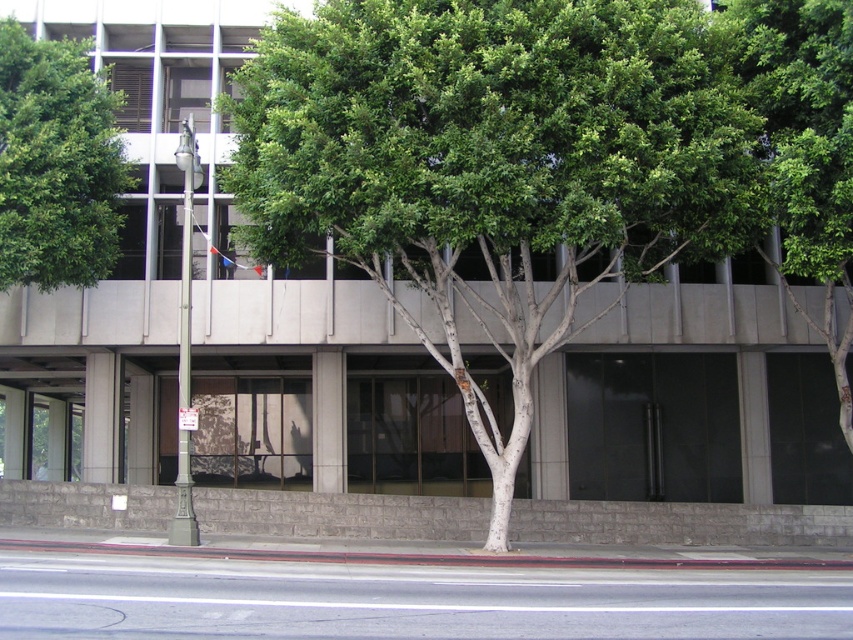
Does green leafy tree at center lie in front of green leafy tree at upper left?

Yes, green leafy tree at center is in front of green leafy tree at upper left.

Which is below, green leafy tree at center or green leafy tree at upper left?

green leafy tree at center

Image resolution: width=853 pixels, height=640 pixels. I want to click on green leafy tree at center, so click(x=494, y=164).

Locate an element on the screen. The image size is (853, 640). green leafy tree at center is located at coordinates (494, 164).

Who is more distant from viewer, (550, 180) or (763, 100)?

The point (763, 100) is behind.

Who is higher up, green leafy tree at center or green leafy tree at upper center?

green leafy tree at center is higher up.

Is point (474, 268) positioned before point (790, 273)?

That is False.

This screenshot has height=640, width=853. What are the coordinates of `green leafy tree at center` in the screenshot? It's located at (494, 164).

Can you confirm if green leafy tree at upper center is thinner than green leafy tree at upper left?

Correct, green leafy tree at upper center's width is less than green leafy tree at upper left's.

Which is behind, point (846, 17) or point (48, 266)?

The point (48, 266) is more distant.

Where is `green leafy tree at upper center`? This screenshot has width=853, height=640. green leafy tree at upper center is located at coordinates (804, 150).